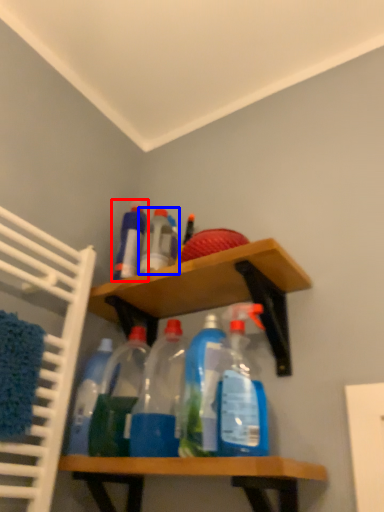
Question: Among these objects, which one is nearest to the camera, bottle (highlighted by a red box) or bottle (highlighted by a blue box)?

Choices:
 (A) bottle
 (B) bottle

Answer: (B)